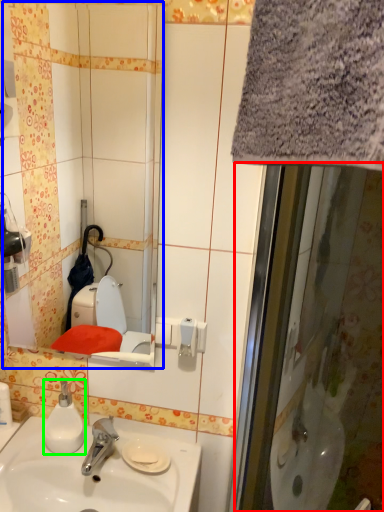
Question: Which object is the closest to the screen door (highlighted by a red box)? Choose among these: mirror (highlighted by a blue box) or soap dispenser (highlighted by a green box).

Choices:
 (A) mirror
 (B) soap dispenser

Answer: (B)